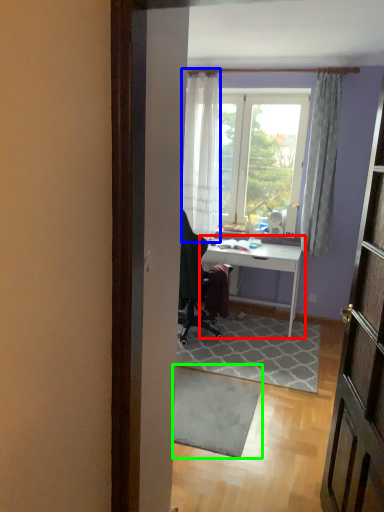
Question: Which object is the farthest from desk (highlighted by a red box)? Choose among these: curtain (highlighted by a blue box) or doormat (highlighted by a green box).

Choices:
 (A) curtain
 (B) doormat

Answer: (B)